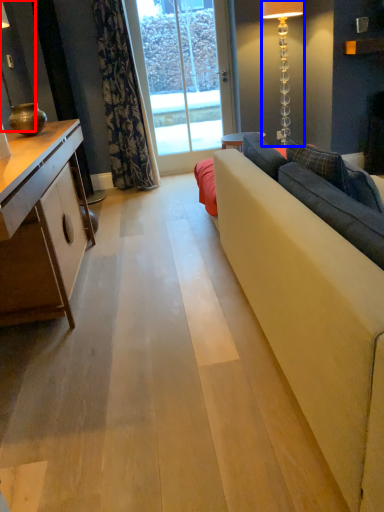
Question: Among these objects, which one is nearest to the camera, lamp (highlighted by a red box) or lamp (highlighted by a blue box)?

Choices:
 (A) lamp
 (B) lamp

Answer: (A)